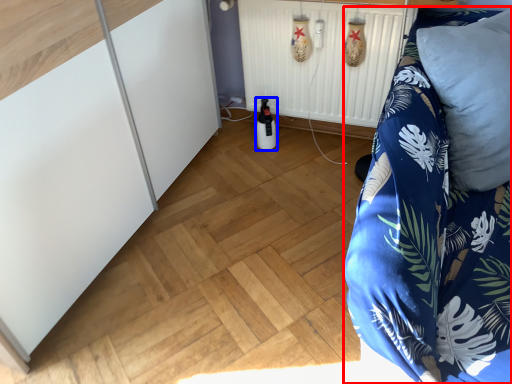
Question: Which point is further to the camera, furniture (highlighted by a red box) or bottle (highlighted by a blue box)?

Choices:
 (A) furniture
 (B) bottle

Answer: (B)